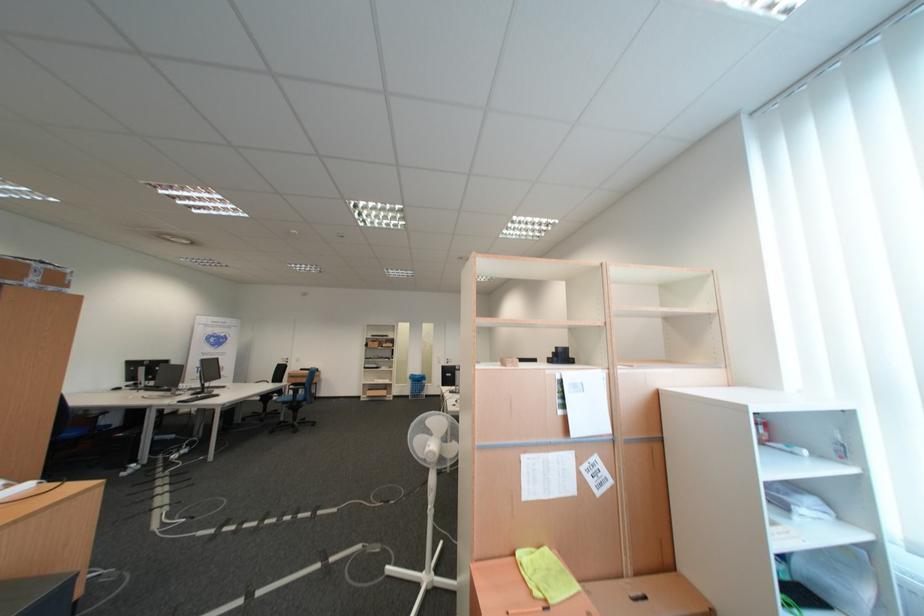
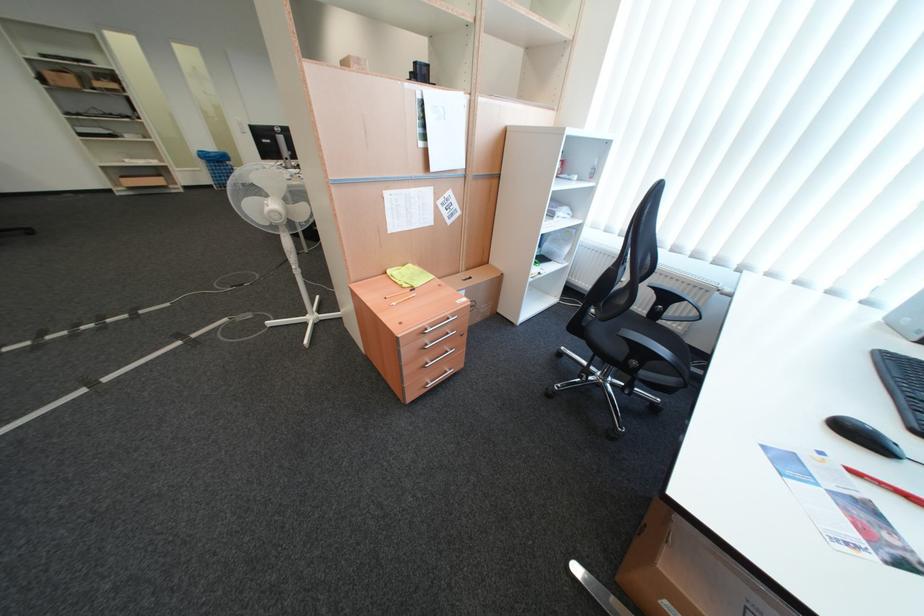
Where in the second image is the point corresponding to pixel 648 577 from the first image?

(479, 272)